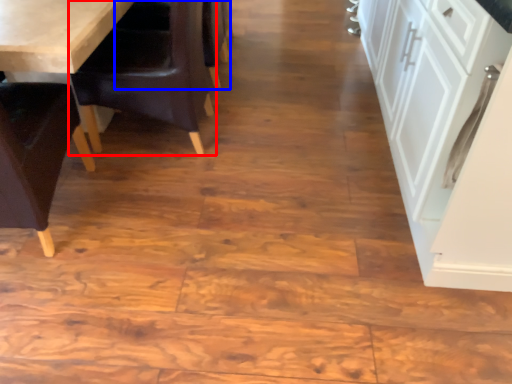
Question: Which point is further to the camera, chair (highlighted by a red box) or armchair (highlighted by a blue box)?

Choices:
 (A) chair
 (B) armchair

Answer: (B)